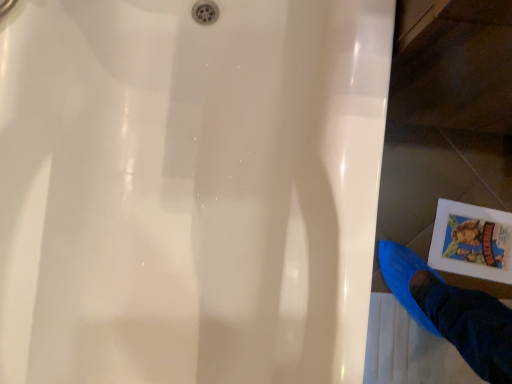
Question: Can you confirm if white paper comic book at lower right is smaller than blue fabric foot at lower right?

Choices:
 (A) yes
 (B) no

Answer: (A)

Question: Is white paper comic book at lower right not within blue fabric foot at lower right?

Choices:
 (A) yes
 (B) no

Answer: (A)

Question: Does white paper comic book at lower right appear on the left side of blue fabric foot at lower right?

Choices:
 (A) no
 (B) yes

Answer: (A)

Question: Is white paper comic book at lower right closer to camera compared to blue fabric foot at lower right?

Choices:
 (A) no
 (B) yes

Answer: (A)

Question: From a real-world perspective, is white paper comic book at lower right located higher than blue fabric foot at lower right?

Choices:
 (A) yes
 (B) no

Answer: (B)

Question: Is white paper comic book at lower right far from blue fabric foot at lower right?

Choices:
 (A) yes
 (B) no

Answer: (B)

Question: Is blue fabric foot at lower right at the right side of white paper comic book at lower right?

Choices:
 (A) yes
 (B) no

Answer: (B)

Question: Does blue fabric foot at lower right have a lesser width compared to white paper comic book at lower right?

Choices:
 (A) yes
 (B) no

Answer: (B)

Question: From a real-world perspective, is blue fabric foot at lower right positioned over white paper comic book at lower right based on gravity?

Choices:
 (A) no
 (B) yes

Answer: (B)

Question: Is blue fabric foot at lower right at the left side of white paper comic book at lower right?

Choices:
 (A) no
 (B) yes

Answer: (B)

Question: Is blue fabric foot at lower right aimed at white paper comic book at lower right?

Choices:
 (A) yes
 (B) no

Answer: (B)

Question: Is blue fabric foot at lower right in front of white paper comic book at lower right?

Choices:
 (A) yes
 (B) no

Answer: (A)

Question: Relative to blue fabric foot at lower right, is white paper comic book at lower right in front or behind?

Choices:
 (A) front
 (B) behind

Answer: (B)